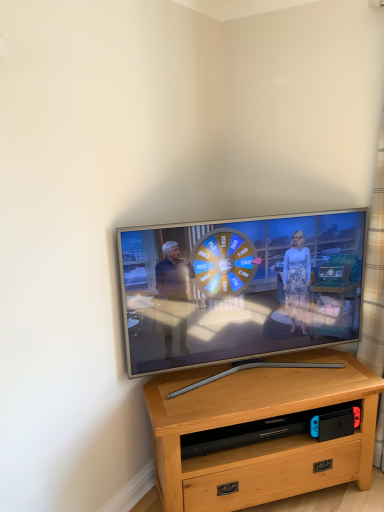
In order to face light brown wood desk at center, should I rotate leftwards or rightwards?

Rotate your view right by about 9.787°.

Find the location of `light brown wood desk at center`. light brown wood desk at center is located at coordinates (261, 442).

Image resolution: width=384 pixels, height=512 pixels. I want to click on silver metallic tv at center, so click(239, 288).

I want to click on curtain lying above the light brown wood desk at center (from the image's perspective), so click(x=374, y=272).

How different are the orientations of light brown wood desk at center and plaid fabric curtain at right in degrees?

light brown wood desk at center and plaid fabric curtain at right are facing 48.2 degrees away from each other.

Is the depth of light brown wood desk at center greater than that of plaid fabric curtain at right?

That is True.

Between point (346, 370) and point (380, 234), which one is positioned behind?

The point (346, 370) is farther.

Considering the relative sizes of plaid fabric curtain at right and light brown wood desk at center in the image provided, is plaid fabric curtain at right wider than light brown wood desk at center?

No, plaid fabric curtain at right is not wider than light brown wood desk at center.

Is plaid fabric curtain at right taller than light brown wood desk at center?

Yes.

Between plaid fabric curtain at right and light brown wood desk at center, which one has smaller size?

With smaller size is plaid fabric curtain at right.

Does plaid fabric curtain at right turn towards silver metallic tv at center?

No, plaid fabric curtain at right is not facing towards silver metallic tv at center.

Can you tell me how much plaid fabric curtain at right and silver metallic tv at center differ in facing direction?

48.5 degrees separate the facing orientations of plaid fabric curtain at right and silver metallic tv at center.

Consider the image. Is plaid fabric curtain at right positioned behind silver metallic tv at center?

No, plaid fabric curtain at right is in front of silver metallic tv at center.

Is plaid fabric curtain at right not near silver metallic tv at center?

No, plaid fabric curtain at right is not far from silver metallic tv at center.

Considering the sizes of objects light brown wood desk at center and silver metallic tv at center in the image provided, who is bigger, light brown wood desk at center or silver metallic tv at center?

Bigger between the two is light brown wood desk at center.

Locate an element on the screen. The image size is (384, 512). television that is in front of the light brown wood desk at center is located at coordinates (239, 288).

Is light brown wood desk at center facing away from silver metallic tv at center?

light brown wood desk at center does not have its back to silver metallic tv at center.

Based on the photo, from the image's perspective, is silver metallic tv at center located above light brown wood desk at center?

Yes, from the image's perspective, silver metallic tv at center is above light brown wood desk at center.

Can you confirm if silver metallic tv at center is smaller than light brown wood desk at center?

Indeed, silver metallic tv at center has a smaller size compared to light brown wood desk at center.

Which is behind, silver metallic tv at center or light brown wood desk at center?

light brown wood desk at center.

From a real-world perspective, which is physically above, silver metallic tv at center or light brown wood desk at center?

From a 3D spatial view, silver metallic tv at center is above.

Identify the location of television located behind the plaid fabric curtain at right. (239, 288).

Could you tell me if silver metallic tv at center is turned towards plaid fabric curtain at right?

No, silver metallic tv at center is not oriented towards plaid fabric curtain at right.

Is point (299, 223) closer or farther from the camera than point (377, 202)?

Point (299, 223).

I want to click on desk behind the plaid fabric curtain at right, so click(x=261, y=442).

This screenshot has width=384, height=512. I want to click on desk on the left of plaid fabric curtain at right, so (x=261, y=442).

When comparing their distances from plaid fabric curtain at right, does light brown wood desk at center or silver metallic tv at center seem further?

light brown wood desk at center.

Considering their positions, is light brown wood desk at center positioned closer to silver metallic tv at center than plaid fabric curtain at right?

light brown wood desk at center.

Estimate the real-world distances between objects in this image. Which object is closer to light brown wood desk at center, plaid fabric curtain at right or silver metallic tv at center?

The object closer to light brown wood desk at center is silver metallic tv at center.

Estimate the real-world distances between objects in this image. Which object is further from light brown wood desk at center, silver metallic tv at center or plaid fabric curtain at right?

plaid fabric curtain at right.

Looking at this image, looking at the image, which one is located further to plaid fabric curtain at right, silver metallic tv at center or light brown wood desk at center?

light brown wood desk at center is positioned further to the anchor plaid fabric curtain at right.

Estimate the real-world distances between objects in this image. Which object is closer to silver metallic tv at center, plaid fabric curtain at right or light brown wood desk at center?

light brown wood desk at center.

Where is `television between plaid fabric curtain at right and light brown wood desk at center in the vertical direction`? This screenshot has width=384, height=512. television between plaid fabric curtain at right and light brown wood desk at center in the vertical direction is located at coordinates point(239,288).